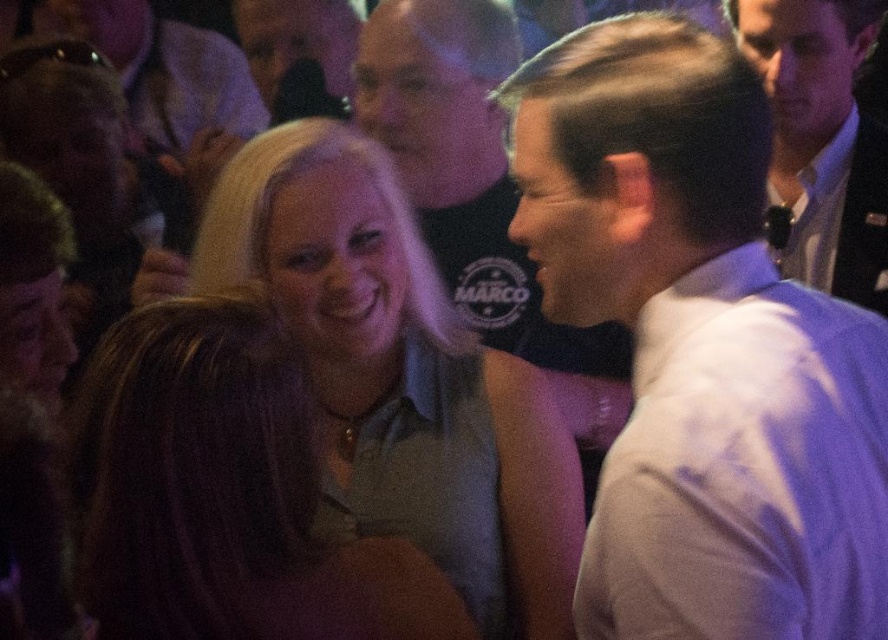
This screenshot has height=640, width=888. Describe the element at coordinates (223, 493) in the screenshot. I see `matte gray shirt at center` at that location.

Can you confirm if matte gray shirt at center is shorter than white shirt at right?

Indeed, matte gray shirt at center has a lesser height compared to white shirt at right.

The image size is (888, 640). What do you see at coordinates (223, 493) in the screenshot?
I see `matte gray shirt at center` at bounding box center [223, 493].

Where is `matte gray shirt at center`? matte gray shirt at center is located at coordinates (223, 493).

Can you confirm if light gray sleeveless top at center is positioned to the right of matte gray shirt at center?

Yes, light gray sleeveless top at center is to the right of matte gray shirt at center.

Locate an element on the screen. light gray sleeveless top at center is located at coordinates (390, 360).

Where is `light gray sleeveless top at center`? light gray sleeveless top at center is located at coordinates (390, 360).

Does light gray sleeveless top at center have a lesser width compared to white shirt at right?

No, light gray sleeveless top at center is not thinner than white shirt at right.

Describe the element at coordinates (390, 360) in the screenshot. This screenshot has height=640, width=888. I see `light gray sleeveless top at center` at that location.

Does point (419, 488) come farther from viewer compared to point (775, 4)?

No, it is in front of (775, 4).

This screenshot has width=888, height=640. I want to click on light gray sleeveless top at center, so click(x=390, y=360).